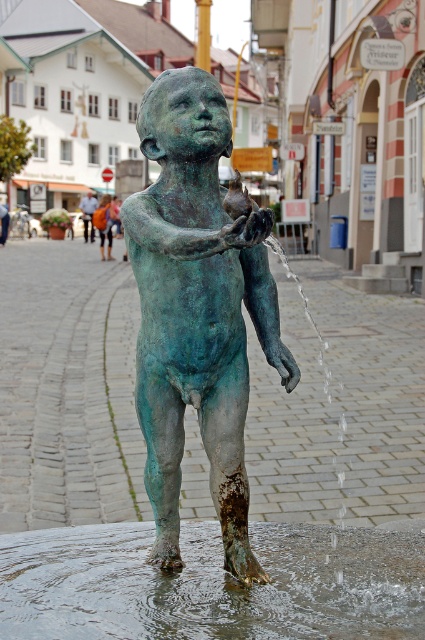
Question: Does green patina statue at center appear on the left side of orange fabric bag at center?

Choices:
 (A) no
 (B) yes

Answer: (A)

Question: Is green patina statue at center above clear liquid water at lower center?

Choices:
 (A) no
 (B) yes

Answer: (B)

Question: Which of these objects is positioned closest to the green patina statue at center?

Choices:
 (A) orange fabric backpack at center
 (B) clear liquid water at lower center
 (C) orange fabric bag at center

Answer: (B)

Question: Based on their relative distances, which object is nearer to the orange fabric backpack at center?

Choices:
 (A) clear liquid water at lower center
 (B) orange fabric bag at center
 (C) green patina statue at center

Answer: (B)

Question: Which of the following is the closest to the observer?

Choices:
 (A) orange fabric bag at center
 (B) clear liquid water at lower center

Answer: (B)

Question: Is clear liquid water at lower center closer to the viewer compared to orange fabric bag at center?

Choices:
 (A) yes
 (B) no

Answer: (A)